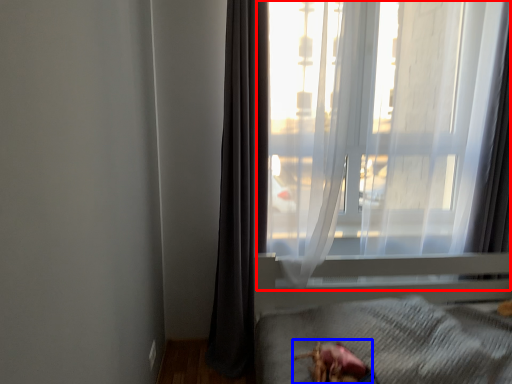
Question: Which object is further to the camera taking this photo, window (highlighted by a red box) or animal (highlighted by a blue box)?

Choices:
 (A) window
 (B) animal

Answer: (A)